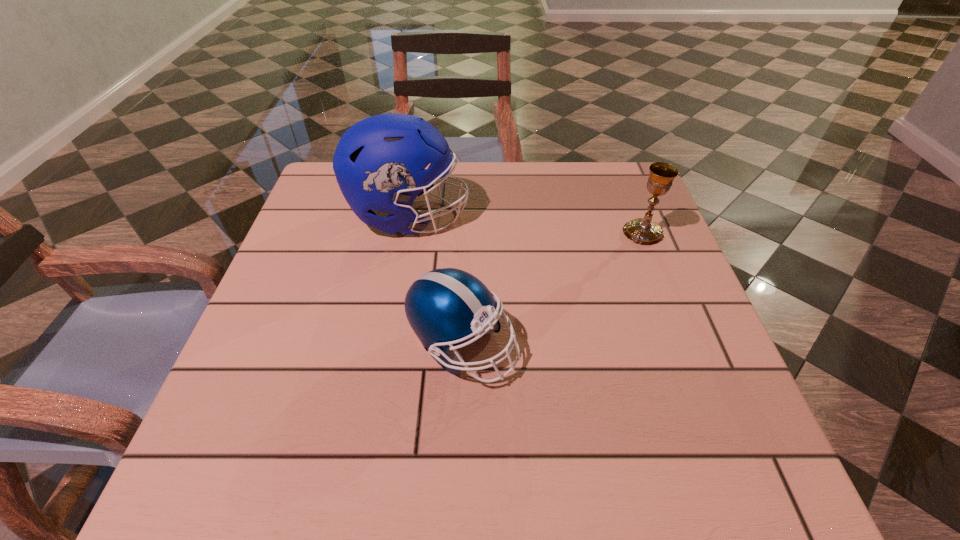
Locate an element on the screen. This screenshot has width=960, height=540. vacant space that satisfies the following two spatial constraints: 1. on the back side of the chalice; 2. on the front-facing side of the tallest object is located at coordinates (636, 216).

This screenshot has height=540, width=960. I want to click on vacant space that satisfies the following two spatial constraints: 1. on the back side of the chalice; 2. on the front-facing side of the tallest object, so click(x=636, y=216).

Identify the location of blank area in the image that satisfies the following two spatial constraints: 1. on the back side of the rightmost object; 2. on the front-facing side of the taller football helmet. (636, 216).